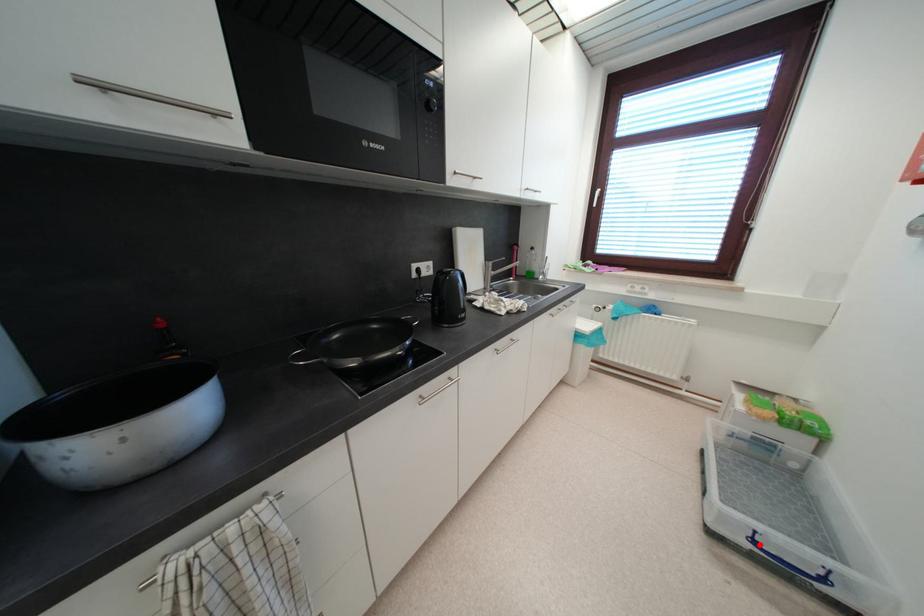
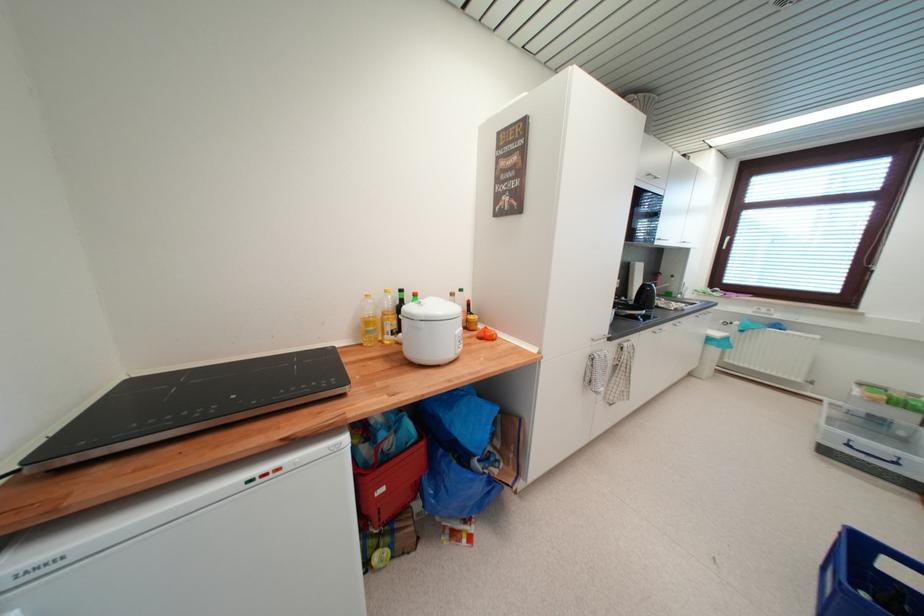
Question: A red point is marked in image1. In image2, is the corresponding 3D point closer to the camera or farther? Reply with the corresponding letter.

Choices:
 (A) The corresponding 3D point is closer.
 (B) The corresponding 3D point is farther.

Answer: (A)